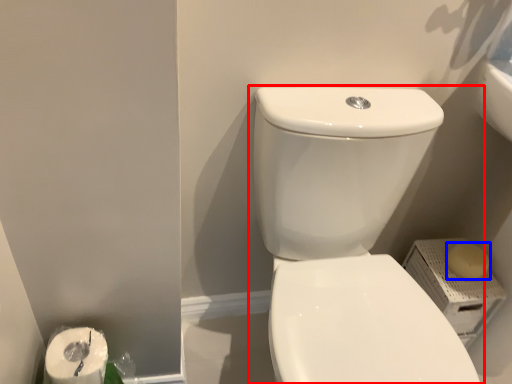
Question: Among these objects, which one is nearest to the camera, toilet (highlighted by a red box) or soap (highlighted by a blue box)?

Choices:
 (A) toilet
 (B) soap

Answer: (A)